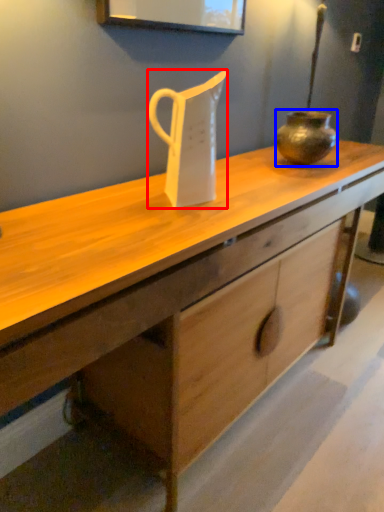
Question: Among these objects, which one is nearest to the camera, jug (highlighted by a red box) or vase (highlighted by a blue box)?

Choices:
 (A) jug
 (B) vase

Answer: (A)